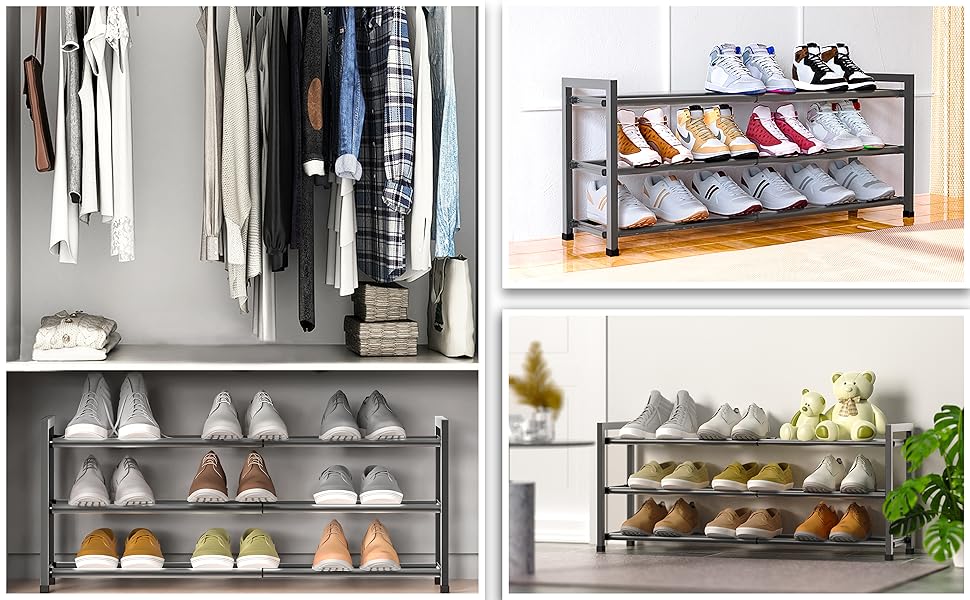
At what (x,y) coordinates should I click in order to perform the action: click on shoe shelves. Please return your answer as a coordinate pair (x, y). The height and width of the screenshot is (600, 970). Looking at the image, I should click on (695, 97), (717, 160), (713, 218), (771, 440), (792, 492), (786, 539), (305, 443), (311, 508), (302, 573).